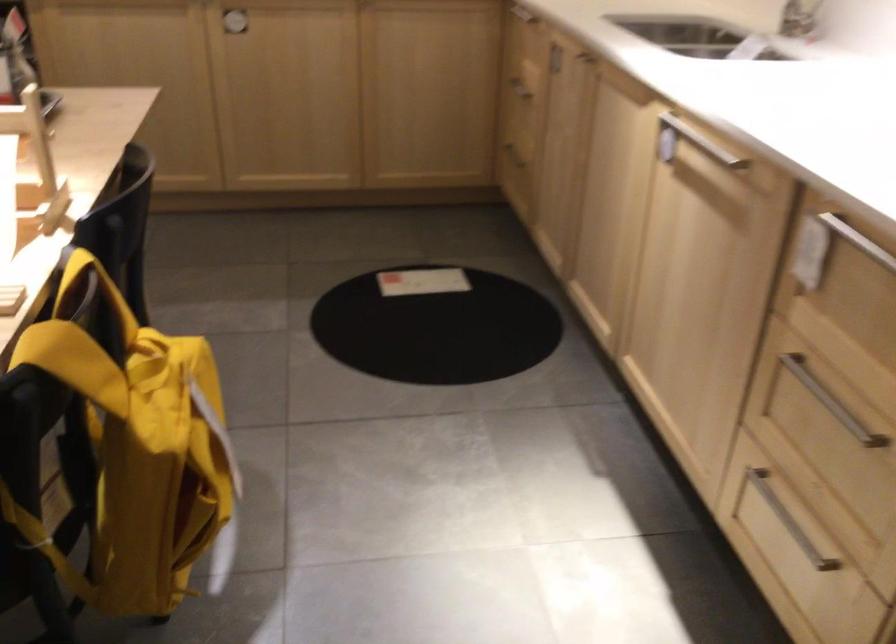
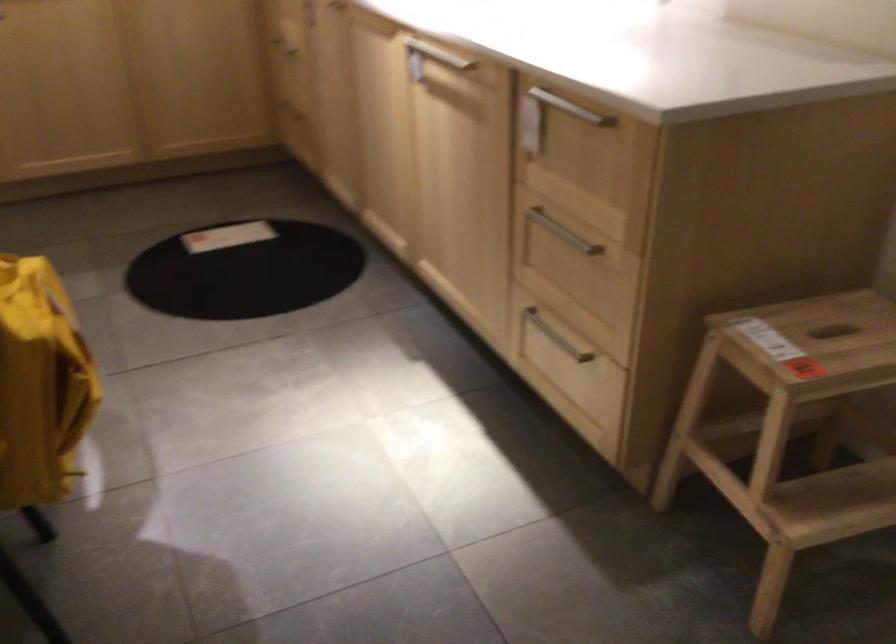
The point at (785, 515) is marked in the first image. Where is the corresponding point in the second image?

(556, 337)